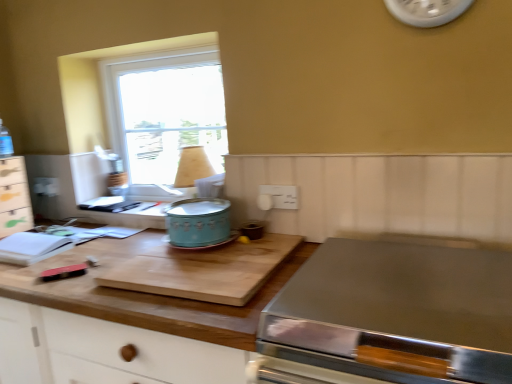
Question: Is wooden cutting board at center further to camera compared to teal enamel crock pot at center?

Choices:
 (A) no
 (B) yes

Answer: (A)

Question: Is wooden cutting board at center oriented away from teal enamel crock pot at center?

Choices:
 (A) no
 (B) yes

Answer: (A)

Question: Does wooden cutting board at center appear on the left side of teal enamel crock pot at center?

Choices:
 (A) no
 (B) yes

Answer: (A)

Question: Is wooden cutting board at center positioned beyond the bounds of teal enamel crock pot at center?

Choices:
 (A) no
 (B) yes

Answer: (B)

Question: Can you confirm if wooden cutting board at center is positioned to the right of teal enamel crock pot at center?

Choices:
 (A) yes
 (B) no

Answer: (A)

Question: Is wooden cutting board at center taller than teal enamel crock pot at center?

Choices:
 (A) no
 (B) yes

Answer: (A)

Question: Can you confirm if teal enamel crock pot at center is smaller than wooden cutting board at center?

Choices:
 (A) yes
 (B) no

Answer: (A)

Question: Can you confirm if teal enamel crock pot at center is shorter than wooden cutting board at center?

Choices:
 (A) yes
 (B) no

Answer: (B)

Question: From the image's perspective, does teal enamel crock pot at center appear higher than wooden cutting board at center?

Choices:
 (A) no
 (B) yes

Answer: (B)

Question: From the image's perspective, would you say teal enamel crock pot at center is shown under wooden cutting board at center?

Choices:
 (A) yes
 (B) no

Answer: (B)

Question: Does teal enamel crock pot at center have a lesser width compared to wooden cutting board at center?

Choices:
 (A) yes
 (B) no

Answer: (A)

Question: Does teal enamel crock pot at center appear on the left side of wooden cutting board at center?

Choices:
 (A) no
 (B) yes

Answer: (B)

Question: Considering the relative positions of clear glass window at upper left and white wood drawer at left in the image provided, is clear glass window at upper left to the right of white wood drawer at left from the viewer's perspective?

Choices:
 (A) no
 (B) yes

Answer: (B)